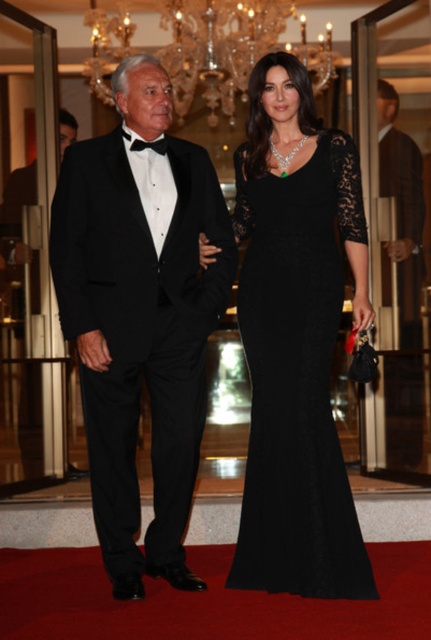
Question: Which point is closer to the camera?

Choices:
 (A) black lace dress at center
 (B) black satin bow tie at center
 (C) smooth brown leather coat at right

Answer: (A)

Question: Which point is farther to the camera?

Choices:
 (A) (130, 188)
 (B) (150, 145)

Answer: (B)

Question: Is matte black tuxedo at left closer to camera compared to smooth brown leather coat at right?

Choices:
 (A) no
 (B) yes

Answer: (B)

Question: Which of these objects is positioned closest to the black lace dress at center?

Choices:
 (A) black satin bow tie at center
 (B) smooth brown leather coat at right

Answer: (A)

Question: From the image, what is the correct spatial relationship of smooth brown leather coat at right in relation to black satin bow tie at center?

Choices:
 (A) above
 (B) below

Answer: (B)

Question: Does black lace dress at center come in front of black satin bow tie at center?

Choices:
 (A) no
 (B) yes

Answer: (B)